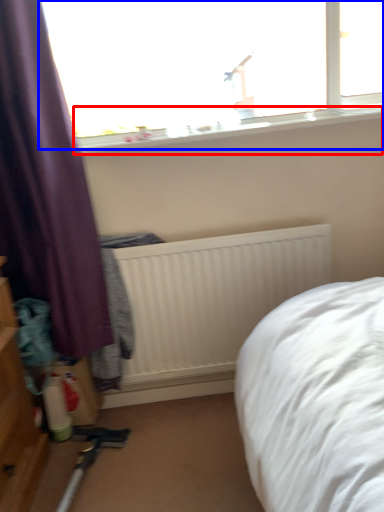
Question: Which of the following is the farthest to the observer, window sill (highlighted by a red box) or window (highlighted by a blue box)?

Choices:
 (A) window sill
 (B) window

Answer: (A)